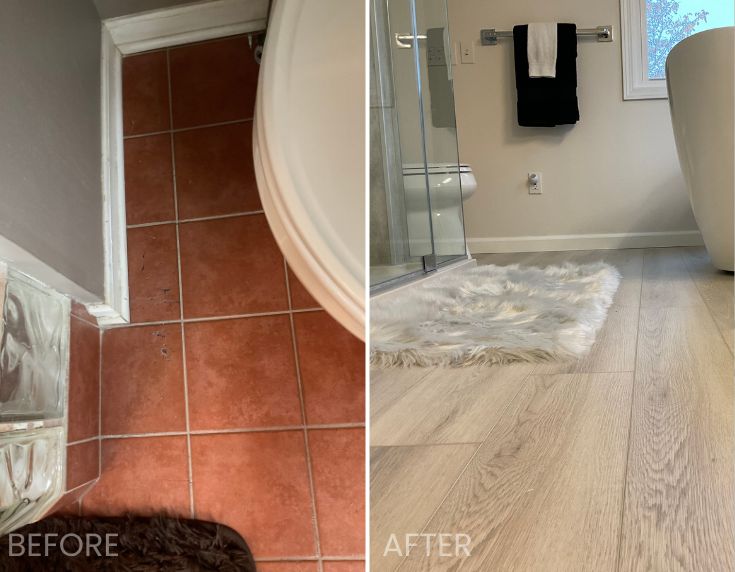
Image resolution: width=735 pixels, height=572 pixels. I want to click on air freshener, so click(534, 178).